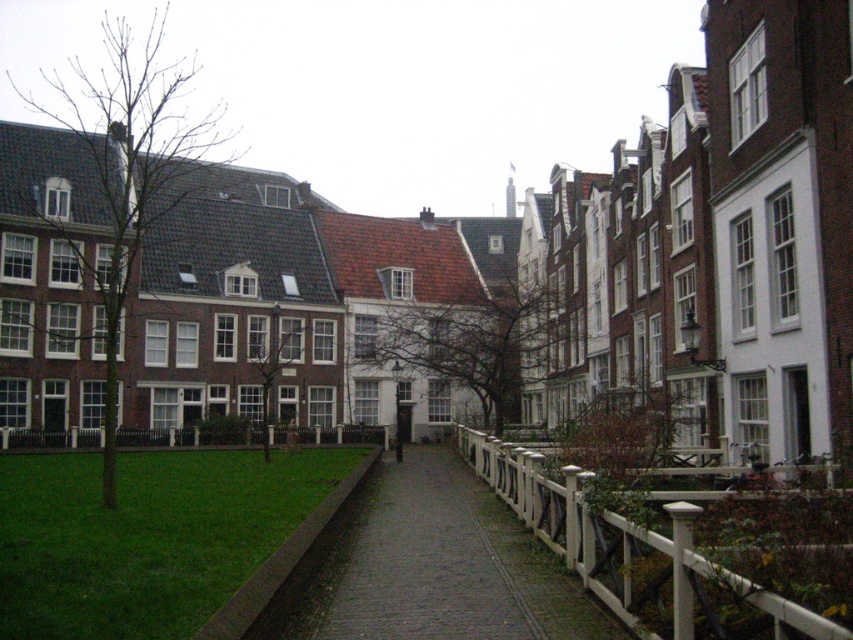
You are standing at the center of the paved pathway in the urban scene. Looking towards the lower left corner of the image, you see a point marked at coordinates (144,536). What is located at that point?

The point at coordinates (144,536) indicates green grass at lower left.

You are a tourist standing on the paved pathway in the urban scene. You see the green grass at lower left and the white wooden fence at lower right. Which object is closer to your current position?

The green grass at lower left is positioned under the white wooden fence at lower right, meaning the green grass at lower left is closer to your current position on the pathway.

You are a gardener planning to plant flowers along the pathway in the image. You have two options for flower beds. One is near the green grass at lower left and the other is near the white wooden fence at lower right. Which location would allow for a larger flower bed area?

The green grass at lower left is larger in size than the white wooden fence at lower right, so the flower bed near the green grass at lower left would allow for a larger area.